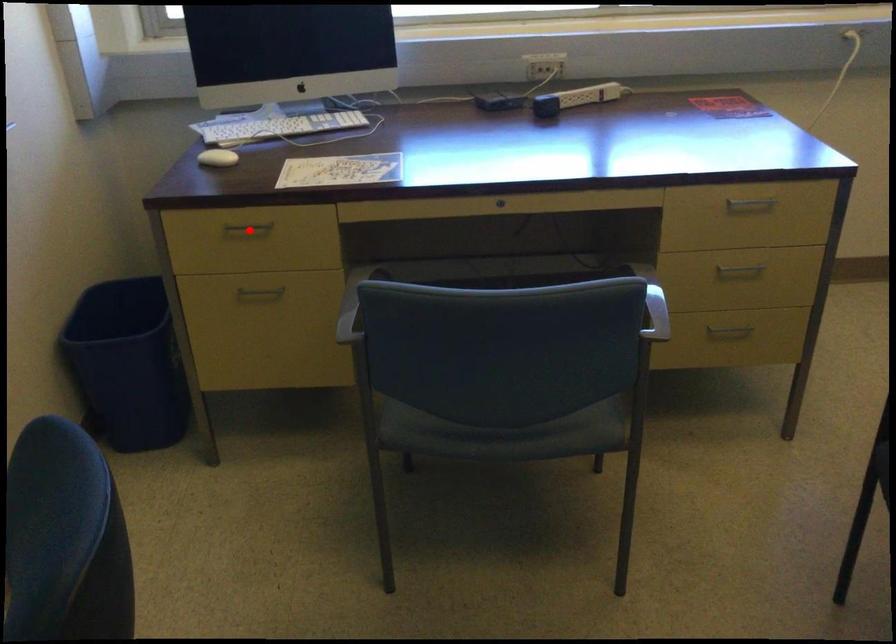
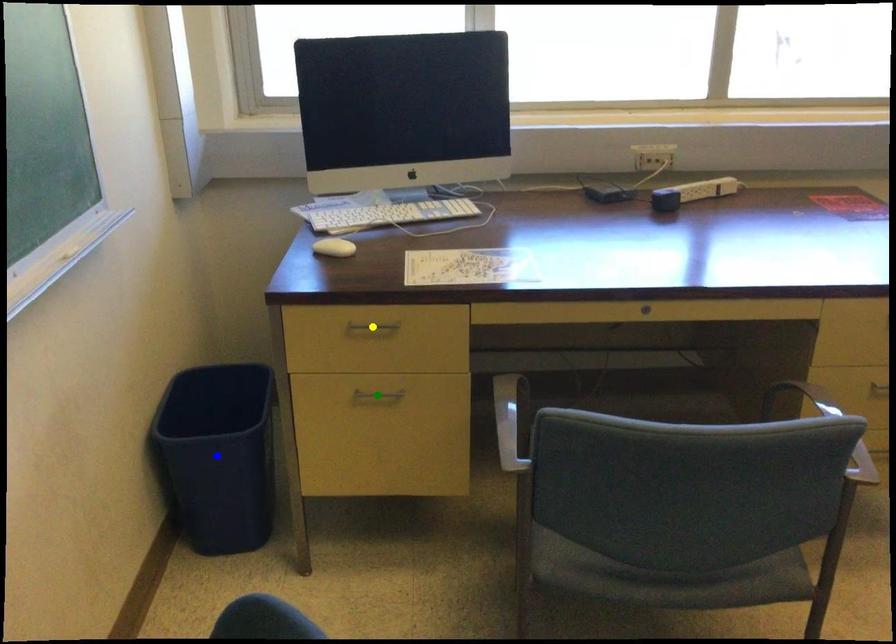
Question: I am providing you with two images of the same scene from different viewpoints. A red point is marked on the first image. You are given multiple points on the second image. Which spot in image 2 lines up with the point in image 1?

Choices:
 (A) blue point
 (B) green point
 (C) yellow point

Answer: (C)